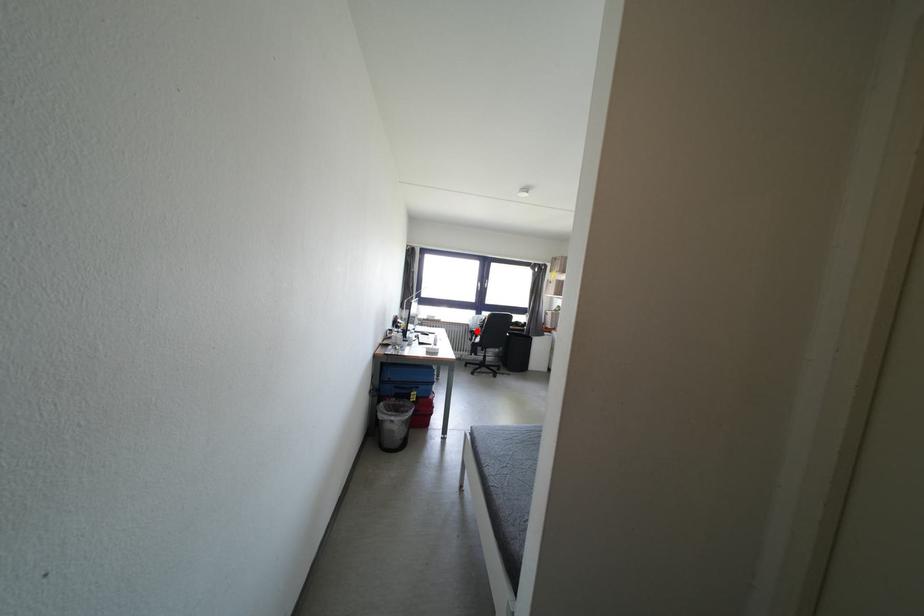
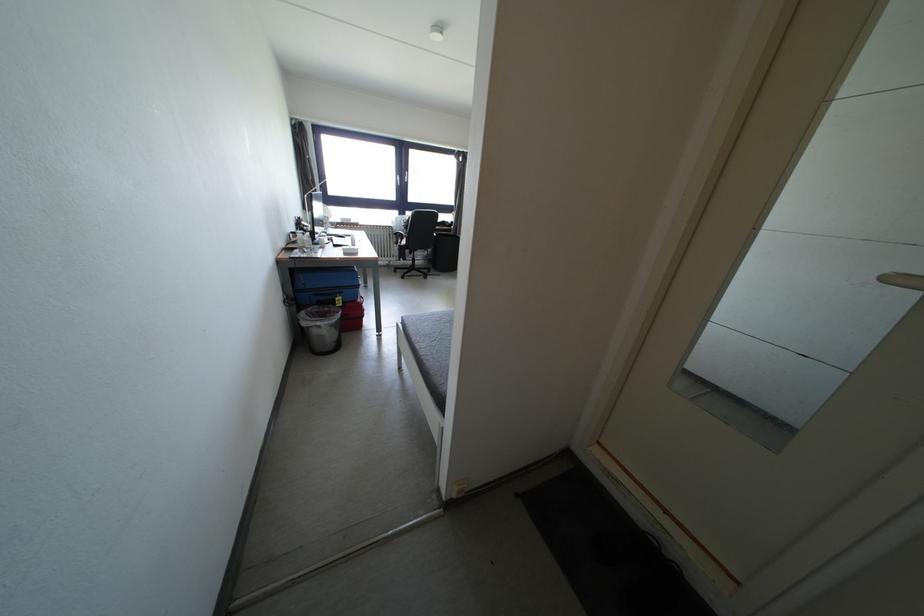
Question: A red point is marked in image1. In image2, is the corresponding 3D point closer to the camera or farther? Reply with the corresponding letter.

Choices:
 (A) The corresponding 3D point is closer.
 (B) The corresponding 3D point is farther.

Answer: (A)